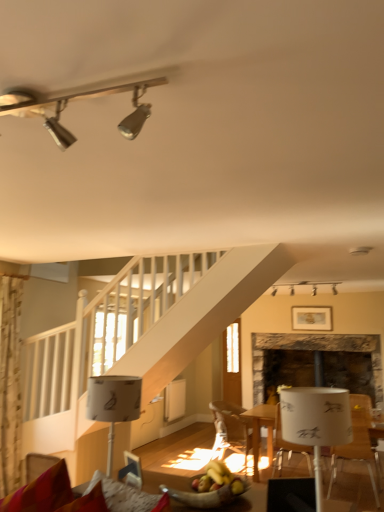
Question: Does stone fireplace at center have a larger size compared to wooden chair at center, which ranks as the 1th chair in left-to-right order?

Choices:
 (A) yes
 (B) no

Answer: (A)

Question: Considering the relative sizes of stone fireplace at center and wooden chair at center, which ranks as the second chair in right-to-left order, in the image provided, is stone fireplace at center shorter than wooden chair at center, which ranks as the second chair in right-to-left order,?

Choices:
 (A) no
 (B) yes

Answer: (A)

Question: Considering the relative positions of stone fireplace at center and wooden chair at center, which ranks as the 1th chair in left-to-right order, in the image provided, is stone fireplace at center to the right of wooden chair at center, which ranks as the 1th chair in left-to-right order, from the viewer's perspective?

Choices:
 (A) yes
 (B) no

Answer: (A)

Question: Is stone fireplace at center next to wooden chair at center, which ranks as the second chair in right-to-left order, and touching it?

Choices:
 (A) yes
 (B) no

Answer: (B)

Question: Is stone fireplace at center taller than wooden chair at center, which ranks as the 1th chair in left-to-right order?

Choices:
 (A) yes
 (B) no

Answer: (A)

Question: From the image's perspective, is stone fireplace at center located above wooden chair at center, which is the first chair in back-to-front order?

Choices:
 (A) no
 (B) yes

Answer: (B)

Question: Is stone fireplace at center wider than wooden framed picture at upper center?

Choices:
 (A) yes
 (B) no

Answer: (A)

Question: Is stone fireplace at center taller than wooden framed picture at upper center?

Choices:
 (A) yes
 (B) no

Answer: (A)

Question: Is the position of stone fireplace at center more distant than that of wooden framed picture at upper center?

Choices:
 (A) no
 (B) yes

Answer: (A)

Question: Is stone fireplace at center looking in the opposite direction of wooden framed picture at upper center?

Choices:
 (A) yes
 (B) no

Answer: (B)

Question: Is stone fireplace at center shorter than wooden framed picture at upper center?

Choices:
 (A) no
 (B) yes

Answer: (A)

Question: Is wooden framed picture at upper center completely or partially inside stone fireplace at center?

Choices:
 (A) no
 (B) yes

Answer: (A)

Question: Does velvet red couch at lower left come behind clear glass door at center?

Choices:
 (A) yes
 (B) no

Answer: (B)